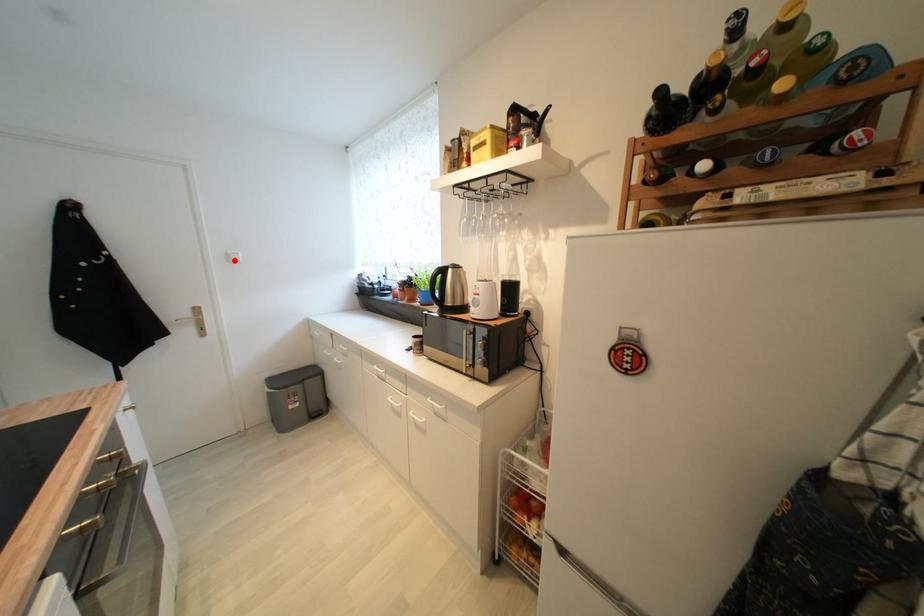
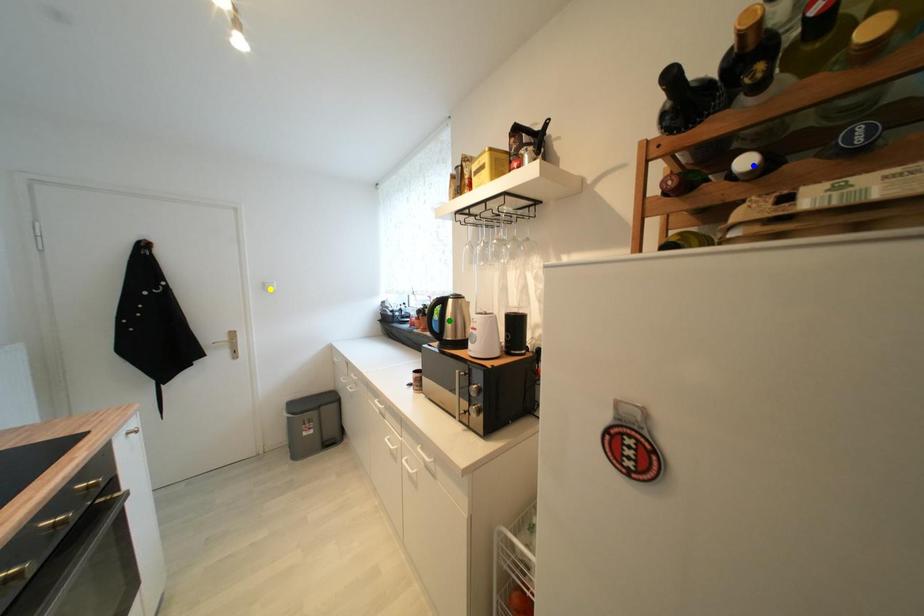
Question: I am providing you with two images of the same scene from different viewpoints. A red point is marked on the first image. You are given multiple points on the second image. Which spot in image 2 lines up with the point in image 1?

Choices:
 (A) yellow point
 (B) green point
 (C) blue point

Answer: (A)